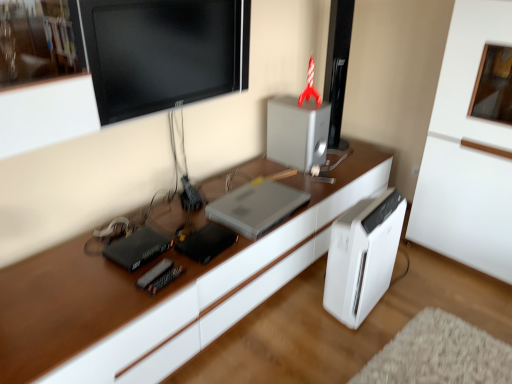
Question: In terms of height, does satin silver laptop at center look taller or shorter compared to white glossy desk at center?

Choices:
 (A) short
 (B) tall

Answer: (B)

Question: Is point (294, 206) closer or farther from the camera than point (136, 289)?

Choices:
 (A) farther
 (B) closer

Answer: (A)

Question: Considering the real-world distances, which object is farthest from the satin silver speaker at upper center, which ranks as the first appliance in top-to-bottom order?

Choices:
 (A) black glossy monitor at upper center
 (B) white plastic air purifier at lower right
 (C) white glossy desk at center
 (D) satin silver laptop at center
 (E) black plastic router at left, which is the 2th appliance in top-to-bottom order

Answer: (E)

Question: Which object is positioned farthest from the black glossy monitor at upper center?

Choices:
 (A) satin silver laptop at center
 (B) satin silver speaker at upper center, which ranks as the 2th appliance in front-to-back order
 (C) white plastic air purifier at lower right
 (D) white glossy desk at center
 (E) black plastic router at left, which is counted as the first appliance, starting from the left

Answer: (C)